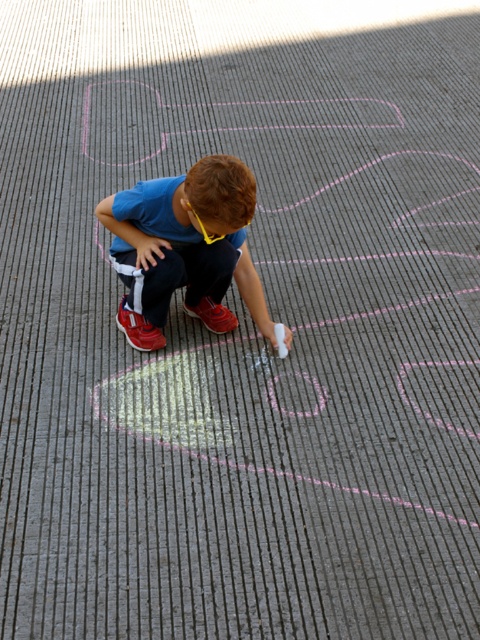
You are a photographer trying to capture the child drawing on the pavement. You want to ensure both the red suede sneaker at lower center and the shiny red sneaker at center are visible in your shot. Which sneaker should you position closer to the left side of the frame to achieve this?

The red suede sneaker at lower center is positioned on the left side of the shiny red sneaker at center, so to have both visible, position the red suede sneaker at lower center closer to the left side of the frame.

You are a photographer trying to capture the red suede sneaker at lower center and the shiny red sneaker at center in a single shot. Which sneaker should you focus on first to ensure it appears in the foreground of your photo?

The red suede sneaker at lower center should be focused on first because it is in front of the shiny red sneaker at center, making it naturally appear in the foreground.

You are a photographer trying to capture the child in the image. You want to ensure both the blue cotton shirt at center and the shiny red sneaker at center are clearly visible in your shot. Given their sizes, which object should you focus on to ensure both are in frame?

The blue cotton shirt at center is larger in size than the shiny red sneaker at center, so focusing on the blue cotton shirt at center will ensure both are in frame since it takes up more space in the image.